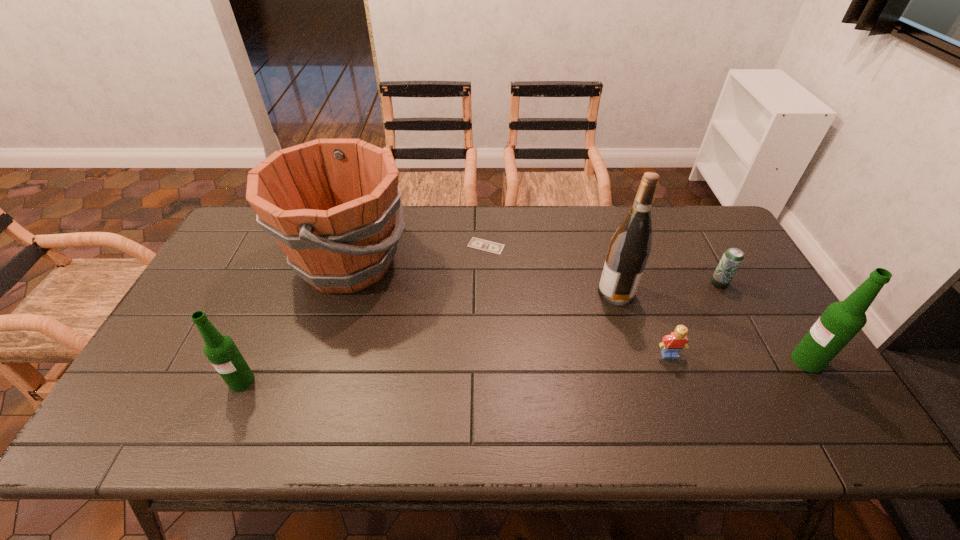
If we want them evenly spaced by inserting an extra beer_bottle among them, please locate a free spot for this new beer_bottle. Please provide its 2D coordinates. Your answer should be formatted as a tuple, i.e. [(x, y)], where the tuple contains the x and y coordinates of a point satisfying the conditions above.

[(530, 370)]